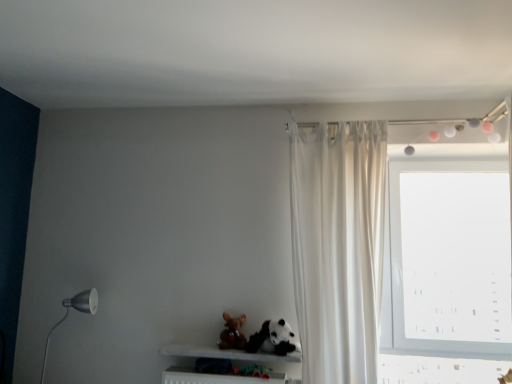
Question: Is transparent glass window at upper right positioned far away from black plush panda at lower center?

Choices:
 (A) no
 (B) yes

Answer: (B)

Question: Is transparent glass window at upper right facing towards black plush panda at lower center?

Choices:
 (A) yes
 (B) no

Answer: (B)

Question: Is transparent glass window at upper right taller than black plush panda at lower center?

Choices:
 (A) no
 (B) yes

Answer: (B)

Question: From a real-world perspective, is transparent glass window at upper right located higher than black plush panda at lower center?

Choices:
 (A) no
 (B) yes

Answer: (B)

Question: Is transparent glass window at upper right positioned behind black plush panda at lower center?

Choices:
 (A) yes
 (B) no

Answer: (A)

Question: Is velvety brown teddy bear at lower center bigger or smaller than black plush panda at lower center?

Choices:
 (A) small
 (B) big

Answer: (A)

Question: Is velvety brown teddy bear at lower center inside the boundaries of black plush panda at lower center, or outside?

Choices:
 (A) outside
 (B) inside

Answer: (A)

Question: In terms of height, does velvety brown teddy bear at lower center look taller or shorter compared to black plush panda at lower center?

Choices:
 (A) short
 (B) tall

Answer: (A)

Question: Is velvety brown teddy bear at lower center in front of or behind black plush panda at lower center in the image?

Choices:
 (A) front
 (B) behind

Answer: (B)

Question: Choose the correct answer: Is black plush panda at lower center inside matte black lamp at left or outside it?

Choices:
 (A) inside
 (B) outside

Answer: (B)

Question: From a real-world perspective, is black plush panda at lower center positioned above or below matte black lamp at left?

Choices:
 (A) below
 (B) above

Answer: (B)

Question: In the image, is black plush panda at lower center on the left side or the right side of matte black lamp at left?

Choices:
 (A) left
 (B) right

Answer: (B)

Question: In the image, is black plush panda at lower center positioned in front of or behind matte black lamp at left?

Choices:
 (A) front
 (B) behind

Answer: (A)

Question: From a real-world perspective, is white marble shelf at lower center positioned above or below matte black lamp at left?

Choices:
 (A) above
 (B) below

Answer: (B)

Question: Would you say white marble shelf at lower center is inside or outside matte black lamp at left?

Choices:
 (A) inside
 (B) outside

Answer: (B)